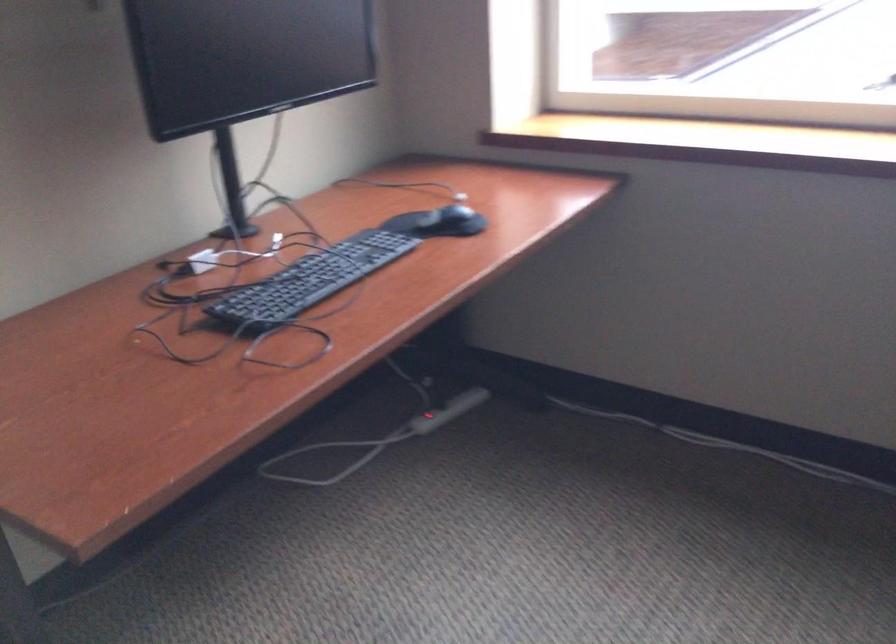
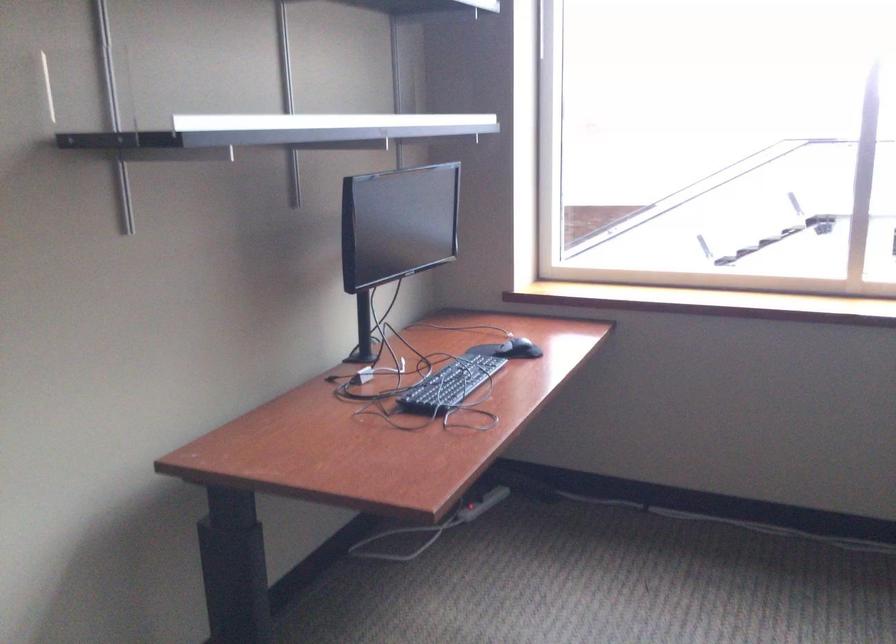
Question: The images are taken continuously from a first-person perspective. In which direction is your viewpoint rotating?

Choices:
 (A) Left
 (B) Right
 (C) Up
 (D) Down

Answer: (C)